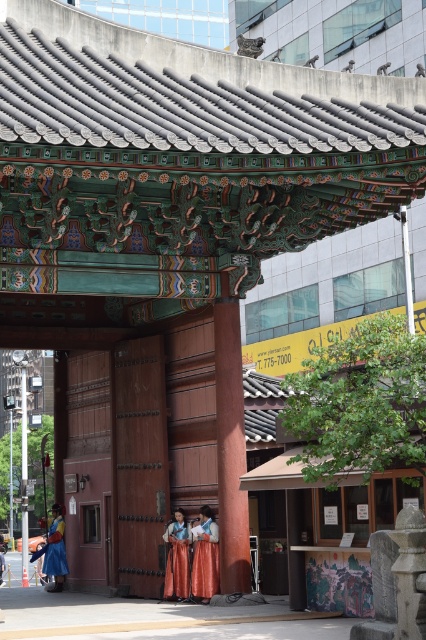
Which is above, orange silk dress at center or matte blue robe at lower left?

Positioned higher is orange silk dress at center.

Does orange silk dress at center have a lesser width compared to matte blue robe at lower left?

Yes, orange silk dress at center is thinner than matte blue robe at lower left.

Does point (210, 532) lie behind point (60, 561)?

No, it is in front of (60, 561).

Identify the location of orange silk dress at center. (206, 557).

Between orange silk dress at center and silk orange dress at center, which one appears on the left side from the viewer's perspective?

silk orange dress at center is more to the left.

Is the position of orange silk dress at center more distant than that of silk orange dress at center?

No, it is not.

Describe the element at coordinates (206, 557) in the screenshot. The image size is (426, 640). I see `orange silk dress at center` at that location.

Identify the location of orange silk dress at center. Image resolution: width=426 pixels, height=640 pixels. (206, 557).

Which of these two, silk orange dress at center or matte blue robe at lower left, stands shorter?

silk orange dress at center is shorter.

Where is `silk orange dress at center`? Image resolution: width=426 pixels, height=640 pixels. silk orange dress at center is located at coordinates (176, 557).

Is point (169, 548) positioned before point (57, 524)?

Yes.

I want to click on silk orange dress at center, so click(x=176, y=557).